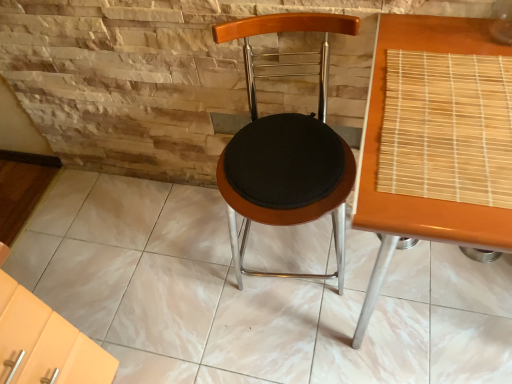
The image size is (512, 384). Identify the location of vacant region below wooden bamboo mat at right (from a real-world perspective). pos(426,296).